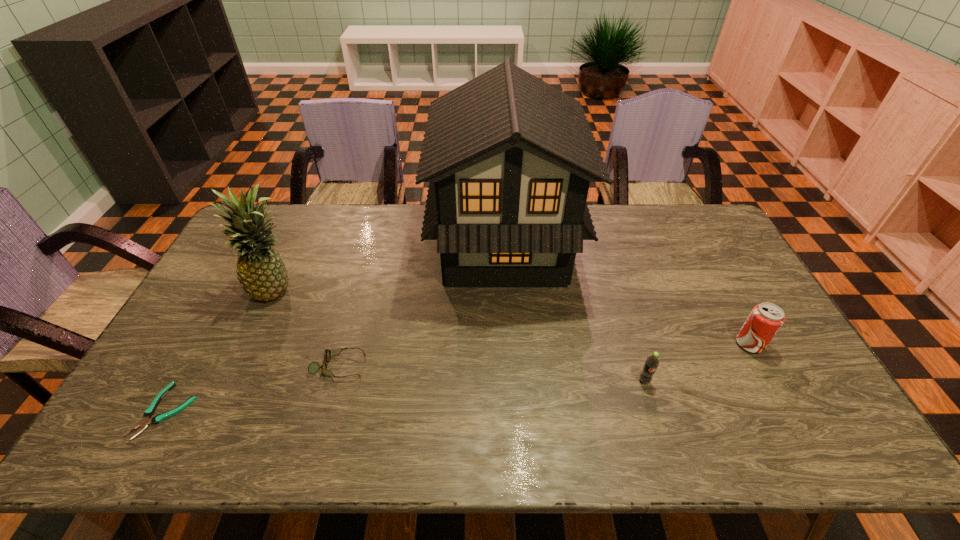
The height and width of the screenshot is (540, 960). Identify the location of pineapple at the left edge. (261, 272).

I want to click on pliers present at the left edge, so click(x=149, y=412).

The image size is (960, 540). Find the location of `object present at the right edge`. object present at the right edge is located at coordinates (765, 320).

The image size is (960, 540). In order to click on object located in the near left corner section of the desktop in this screenshot , I will do `click(149, 412)`.

What are the coordinates of `vacant space at the far edge of the desktop` in the screenshot? It's located at (606, 218).

I want to click on vacant area at the left edge of the desktop, so click(187, 416).

This screenshot has height=540, width=960. In the image, there is a desktop. In order to click on free space at the right edge in this screenshot , I will do `click(722, 257)`.

You are a GUI agent. You are given a task and a screenshot of the screen. Output one action in this format:
    pyautogui.click(x=<x>, y=<y>)
    Task: Click on the vacant region at the far left corner
    
    Given the screenshot: What is the action you would take?
    pyautogui.click(x=297, y=206)

In the image, there is a desktop. Where is `free space at the far right corner`? The width and height of the screenshot is (960, 540). free space at the far right corner is located at coordinates (684, 231).

Where is `vacant space at the near right corner`? The image size is (960, 540). vacant space at the near right corner is located at coordinates (843, 454).